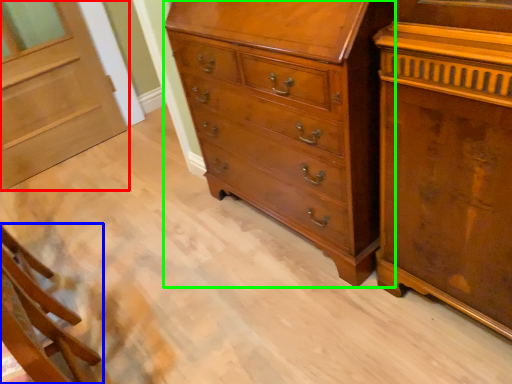
Question: Considering the real-world distances, which object is farthest from door (highlighted by a red box)? furniture (highlighted by a blue box) or chest of drawers (highlighted by a green box)?

Choices:
 (A) furniture
 (B) chest of drawers

Answer: (B)